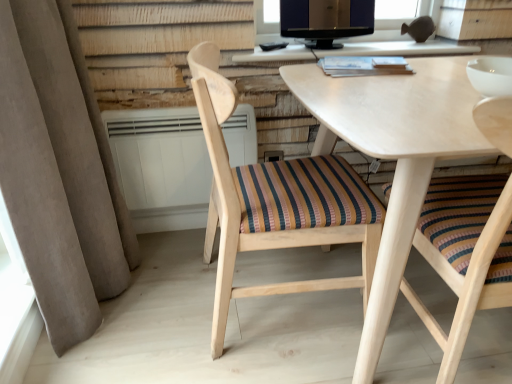
Image resolution: width=512 pixels, height=384 pixels. I want to click on vacant space to the right of beige fabric curtain at left, so click(169, 291).